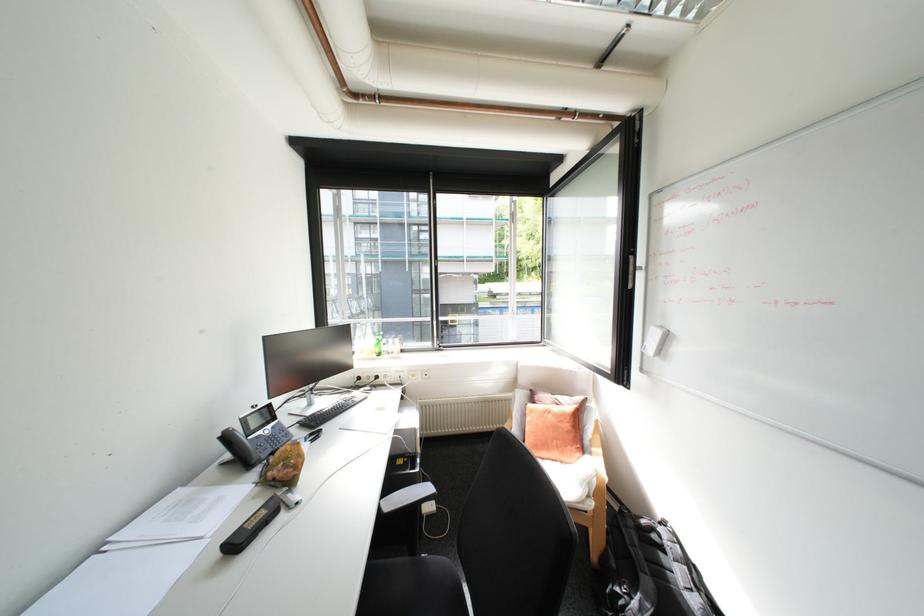
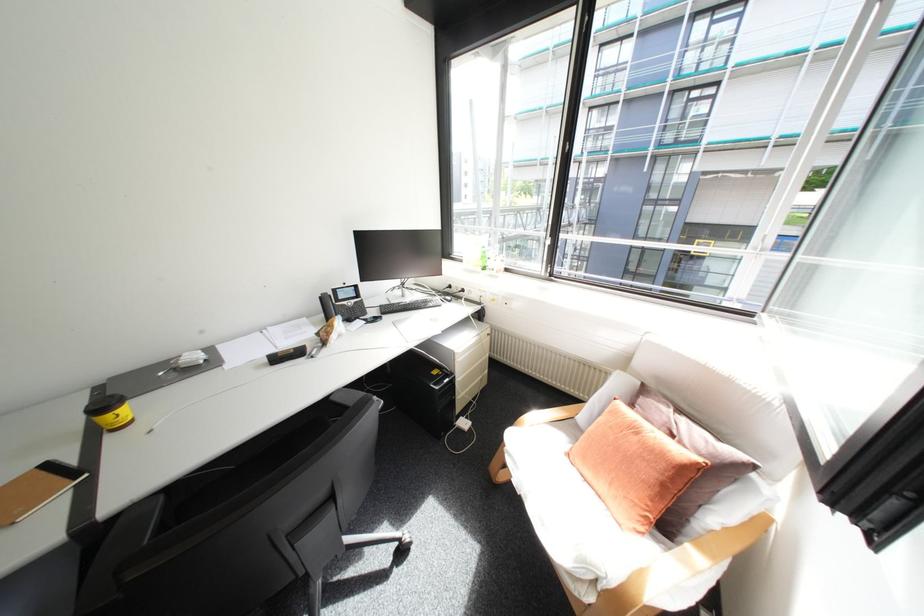
In the second image, find the point that corresponds to (546,419) in the first image.

(621, 428)